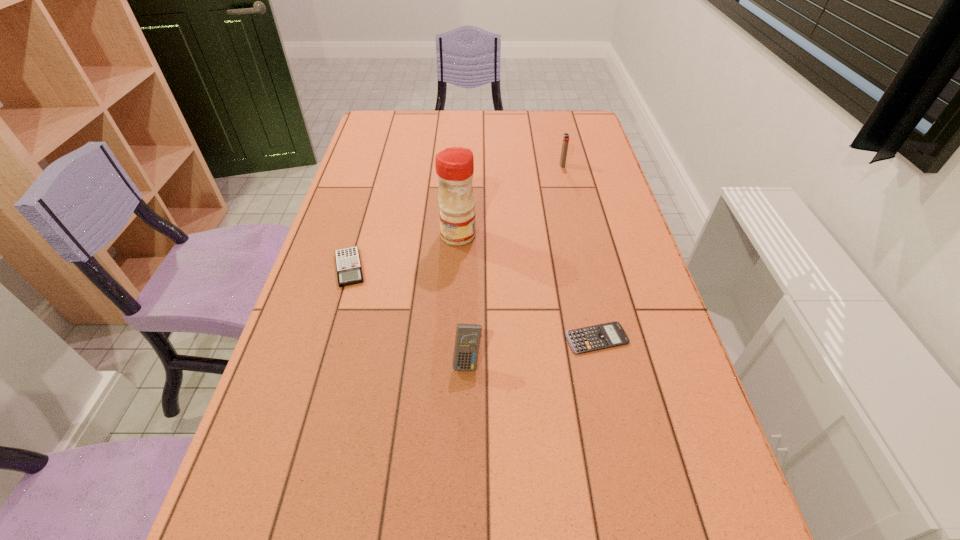
The height and width of the screenshot is (540, 960). I want to click on free space located on the front-facing side of the tallest calculator, so click(465, 500).

Image resolution: width=960 pixels, height=540 pixels. I want to click on free point located on the right of the leftmost calculator, so click(x=516, y=268).

The height and width of the screenshot is (540, 960). Identify the location of vacant space situated 0.290m on the front of the rightmost calculator. (632, 495).

Find the location of a particular element. This screenshot has width=960, height=540. object situated at the left edge is located at coordinates (348, 264).

Locate an element on the screen. Image resolution: width=960 pixels, height=540 pixels. igniter that is positioned at the right edge is located at coordinates (565, 143).

Locate an element on the screen. calculator at the right edge is located at coordinates (592, 338).

At what (x,y) coordinates should I click in order to perform the action: click on free region at the far edge of the desktop. Please return your answer as a coordinate pair (x, y). Image resolution: width=960 pixels, height=540 pixels. Looking at the image, I should click on (536, 111).

Identify the location of free spot at the left edge of the desktop. (299, 484).

Locate an element on the screen. This screenshot has width=960, height=540. vacant space at the right edge of the desktop is located at coordinates 630,241.

Where is `vacant space at the far left corner`? vacant space at the far left corner is located at coordinates (385, 124).